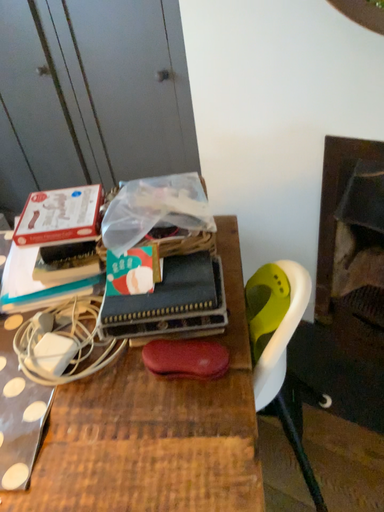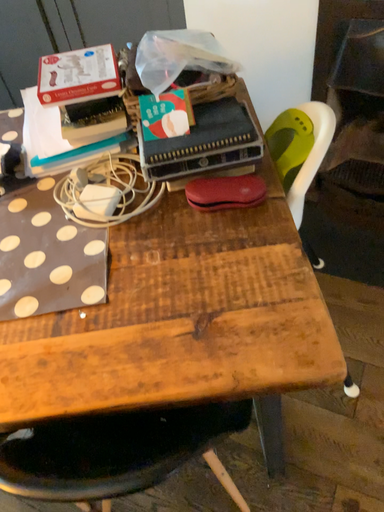
Question: Which way did the camera rotate in the video?

Choices:
 (A) rotated downward
 (B) rotated upward

Answer: (A)